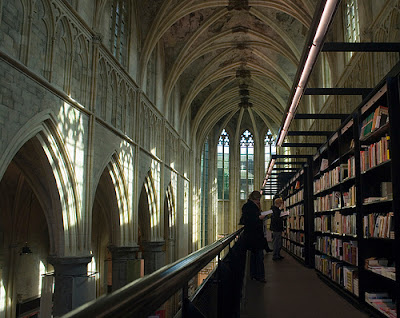
Find the location of a particular element. The height and width of the screenshot is (318, 400). light coming through the windows is located at coordinates (71, 164), (122, 167), (154, 172), (171, 181), (182, 190), (193, 212), (212, 197).